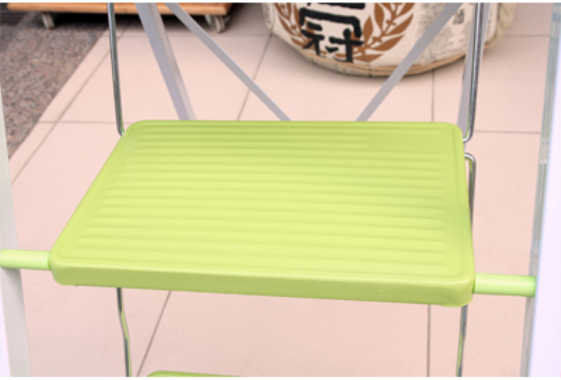
At what (x,y) coordinates should I click in order to perform the action: click on white stone floor. Please return your answer as a coordinate pair (x, y). The width and height of the screenshot is (561, 380). Looking at the image, I should click on (250, 317), (54, 163), (320, 94), (521, 94), (525, 209).